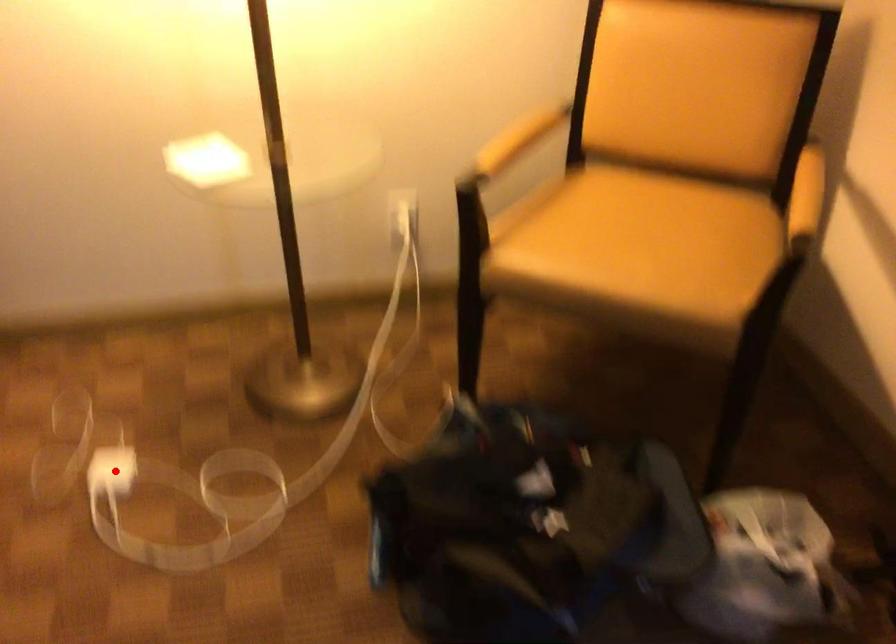
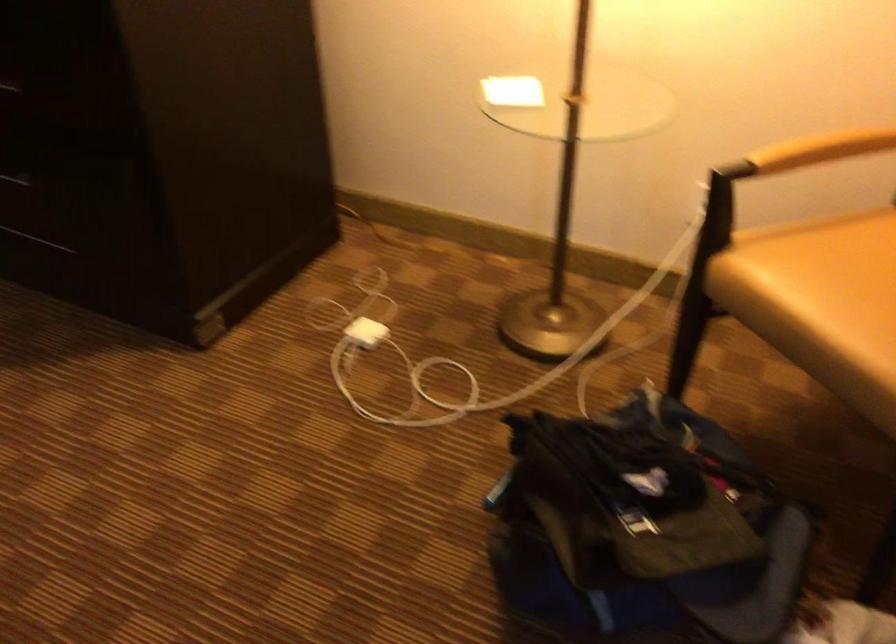
Where in the second image is the point corresponding to the highlighted location from the first image?

(366, 332)